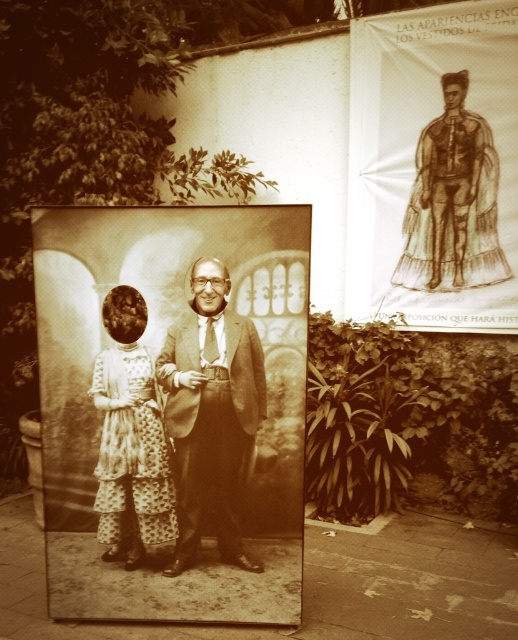
Between point (160, 554) and point (136, 308), which one is positioned in front?

Point (136, 308) is more forward.

Who is lower down, sepia textured poster at center or patterned fabric dress at left?

patterned fabric dress at left is lower down.

Is point (210, 515) more distant than point (154, 422)?

Yes.

At what (x,y) coordinates should I click in order to perform the action: click on sepia textured poster at center. Please return your answer as a coordinate pair (x, y). Looking at the image, I should click on (172, 410).

Who is taller, sepia textured poster at center or smooth brown suit at center?

Standing taller between the two is sepia textured poster at center.

Can you confirm if sepia textured poster at center is thinner than smooth brown suit at center?

No, sepia textured poster at center is not thinner than smooth brown suit at center.

Is point (66, 273) more distant than point (185, 557)?

No, (66, 273) is closer to viewer.

The image size is (518, 640). I want to click on sepia textured poster at center, so click(x=172, y=410).

Measure the distance between sepia textured poster at center and brown paper poster at upper right.

sepia textured poster at center is 2.46 meters from brown paper poster at upper right.

Can you confirm if sepia textured poster at center is smaller than brown paper poster at upper right?

Yes, sepia textured poster at center is smaller than brown paper poster at upper right.

Between point (78, 477) and point (481, 292), which one is positioned behind?

The point (481, 292) is behind.

Find the location of a particular element. The image size is (518, 640). sepia textured poster at center is located at coordinates (172, 410).